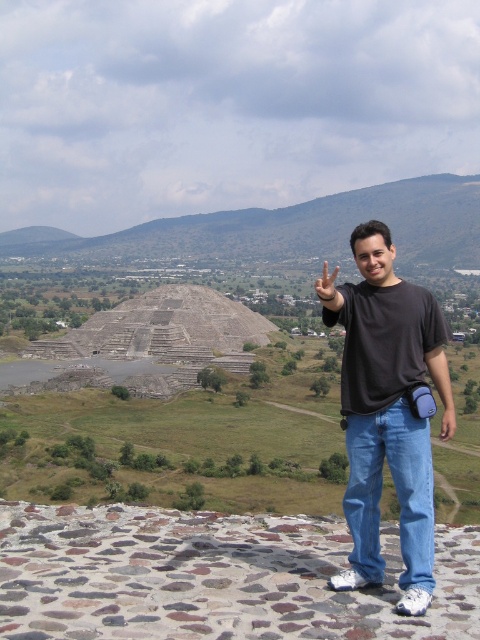
Question: Which object is closer to the camera taking this photo?

Choices:
 (A) matte black hand at center
 (B) black cotton t-shirt at center

Answer: (B)

Question: Where is gray stone pyramid at center-left located in relation to white matte hand at upper center in the image?

Choices:
 (A) above
 (B) below

Answer: (B)

Question: Does black cotton t-shirt at center appear on the left side of matte black hand at center?

Choices:
 (A) no
 (B) yes

Answer: (B)

Question: Considering the real-world distances, which object is farthest from the black cotton t-shirt at center?

Choices:
 (A) matte black hand at center
 (B) gray stone pyramid at center-left

Answer: (B)

Question: Which is farther from the matte black hand at center?

Choices:
 (A) green grassy hill at upper center
 (B) gray stone pyramid at center-left
 (C) black cotton t-shirt at center
 (D) white matte hand at upper center

Answer: (A)

Question: Can you confirm if green grassy hill at upper center is smaller than matte black hand at center?

Choices:
 (A) yes
 (B) no

Answer: (B)